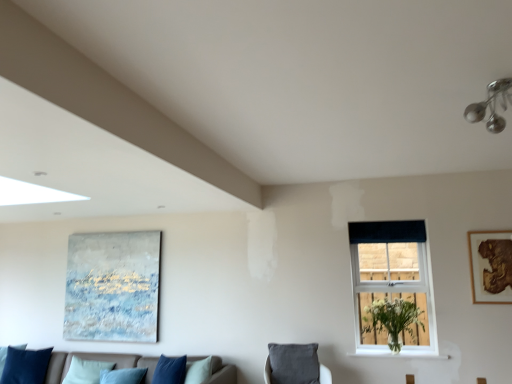
Question: Would you say dark blue fabric at upper right is outside white matte vase at window?

Choices:
 (A) no
 (B) yes

Answer: (B)

Question: Does dark blue fabric at upper right have a lesser width compared to white matte vase at window?

Choices:
 (A) yes
 (B) no

Answer: (A)

Question: Considering the relative positions of dark blue fabric at upper right and white matte vase at window in the image provided, is dark blue fabric at upper right behind white matte vase at window?

Choices:
 (A) no
 (B) yes

Answer: (B)

Question: Is dark blue fabric at upper right at the right side of white matte vase at window?

Choices:
 (A) no
 (B) yes

Answer: (B)

Question: From a real-world perspective, is dark blue fabric at upper right below white matte vase at window?

Choices:
 (A) no
 (B) yes

Answer: (A)

Question: Would you say velvet blue pillow at lower left is to the left or to the right of dark blue fabric at upper right in the picture?

Choices:
 (A) left
 (B) right

Answer: (A)

Question: Considering the positions of velvet blue pillow at lower left and dark blue fabric at upper right in the image, is velvet blue pillow at lower left wider or thinner than dark blue fabric at upper right?

Choices:
 (A) thin
 (B) wide

Answer: (B)

Question: In terms of height, does velvet blue pillow at lower left look taller or shorter compared to dark blue fabric at upper right?

Choices:
 (A) short
 (B) tall

Answer: (B)

Question: Is velvet blue pillow at lower left in front of or behind dark blue fabric at upper right in the image?

Choices:
 (A) behind
 (B) front

Answer: (A)

Question: From a real-world perspective, is white painted wood at lower right above or below wooden framed artwork at upper right, which appears as the first picture frame when viewed from the right?

Choices:
 (A) below
 (B) above

Answer: (A)

Question: Is white painted wood at lower right bigger or smaller than wooden framed artwork at upper right, the 1th picture frame when ordered from front to back?

Choices:
 (A) big
 (B) small

Answer: (B)

Question: Is point (425, 352) closer or farther from the camera than point (500, 279)?

Choices:
 (A) closer
 (B) farther

Answer: (B)

Question: From the image's perspective, is white painted wood at lower right above or below wooden framed artwork at upper right, which appears as the 2th picture frame when viewed from the left?

Choices:
 (A) above
 (B) below

Answer: (B)

Question: Is wooden framed artwork at upper right, which appears as the 2th picture frame when viewed from the left, to the left or to the right of dark blue fabric at upper right in the image?

Choices:
 (A) left
 (B) right

Answer: (B)

Question: Choose the correct answer: Is wooden framed artwork at upper right, the 1th picture frame when ordered from front to back, inside dark blue fabric at upper right or outside it?

Choices:
 (A) outside
 (B) inside

Answer: (A)